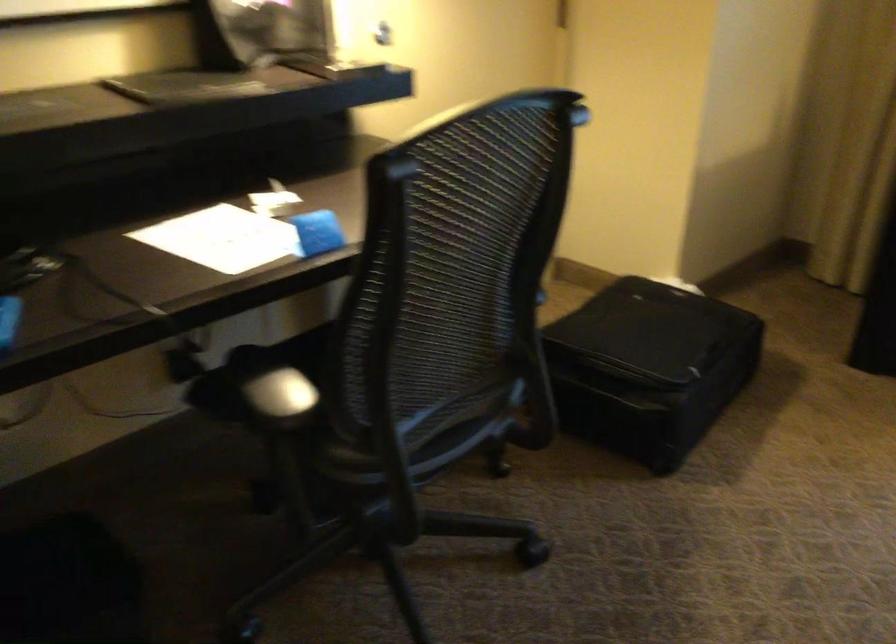
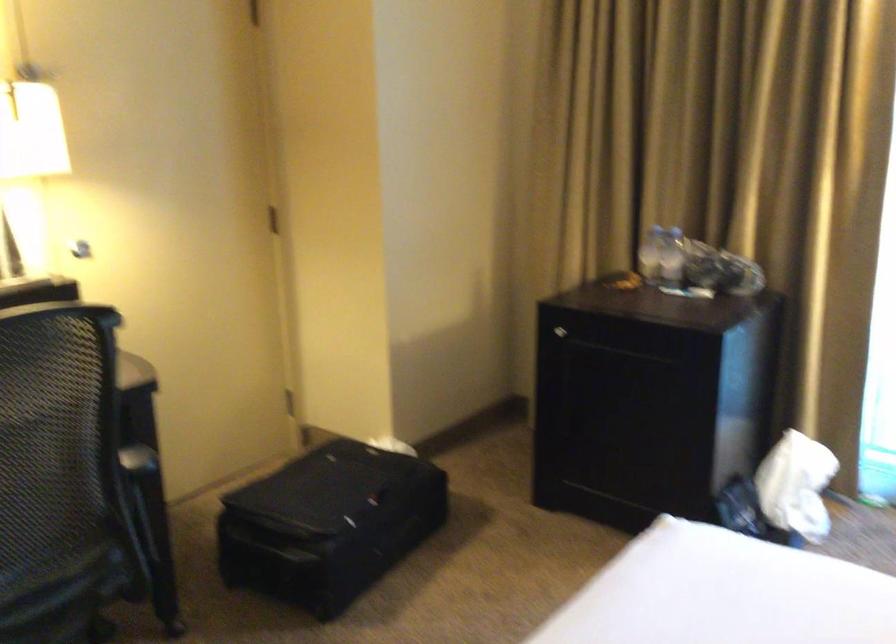
Question: The images are taken continuously from a first-person perspective. In which direction is your viewpoint rotating?

Choices:
 (A) Left
 (B) Right
 (C) Up
 (D) Down

Answer: (C)